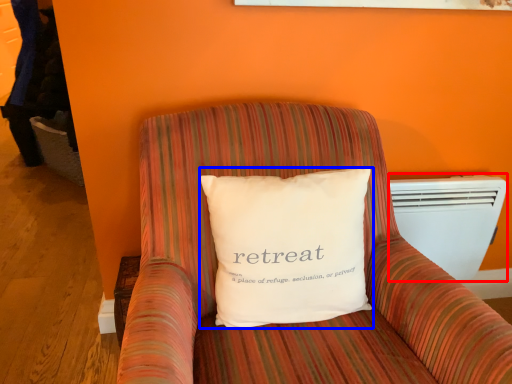
Question: Which point is further to the camera, air conditioning (highlighted by a red box) or pillow (highlighted by a blue box)?

Choices:
 (A) air conditioning
 (B) pillow

Answer: (A)